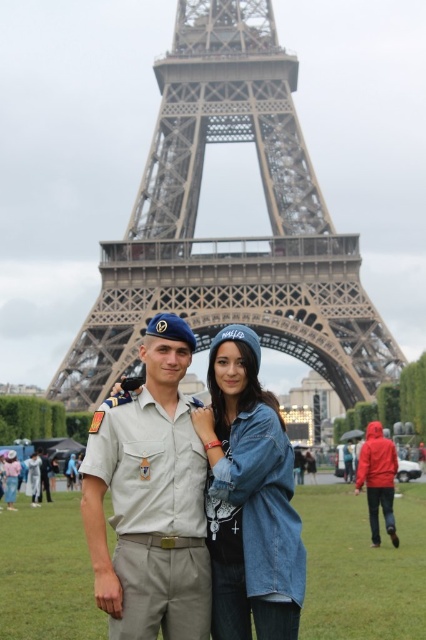
You are standing at the base of the Eiffel Tower and want to take a photo of two points marked in the scene. The first point is at coordinates point (x=124, y=470) and the second point is at point (x=261, y=561). Which point is closer to your camera lens?

Point (x=124, y=470) is further to the camera than point (x=261, y=561). Therefore, the second point at (x=261, y=561) is closer to the camera lens.

You are standing at the base of the Eiffel Tower and want to take a photo of the light beige uniform at center. Where should you position yourself to ensure the uniform is in the frame?

To capture the light beige uniform at center in your photo, position yourself such that the uniform is centered at the coordinates approximately 0.780 along the horizontal axis and 0.352 along the vertical axis of the frame.